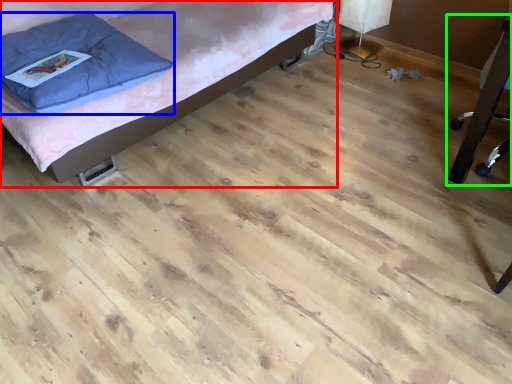
Question: Estimate the real-world distances between objects in this image. Which object is closer to furniture (highlighted by a red box), pillow (highlighted by a blue box) or furniture (highlighted by a green box)?

Choices:
 (A) pillow
 (B) furniture

Answer: (A)